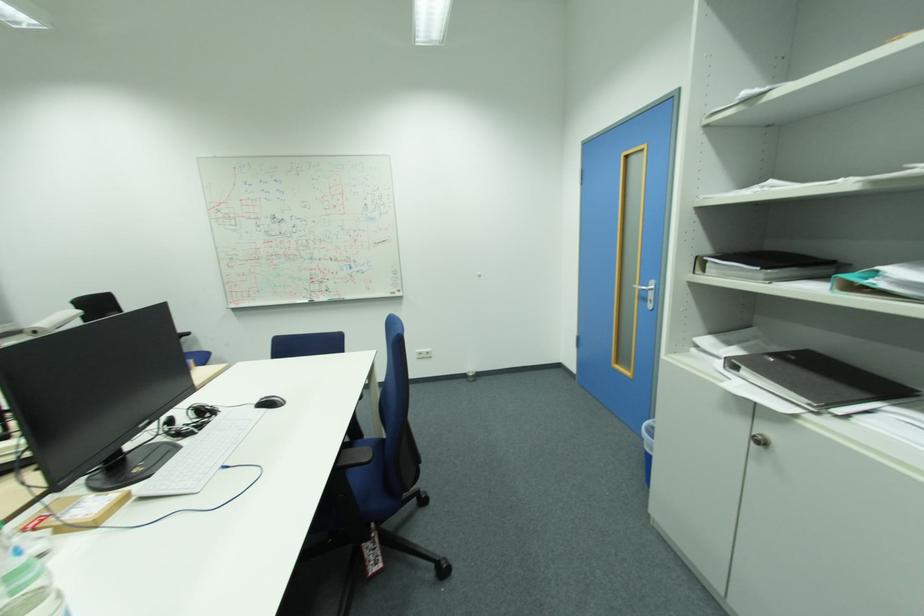
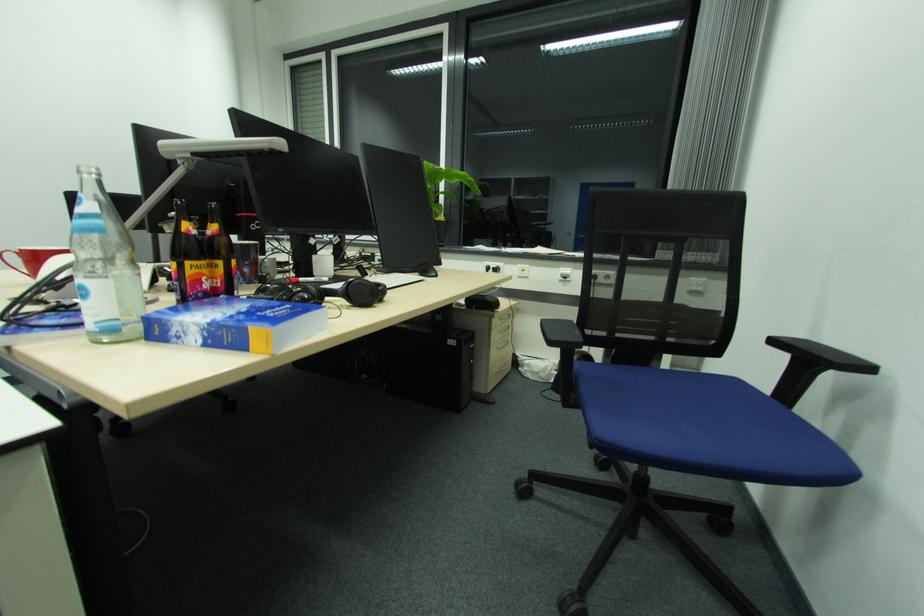
The point at (x=193, y=334) is marked in the first image. Where is the corresponding point in the second image?

(869, 369)